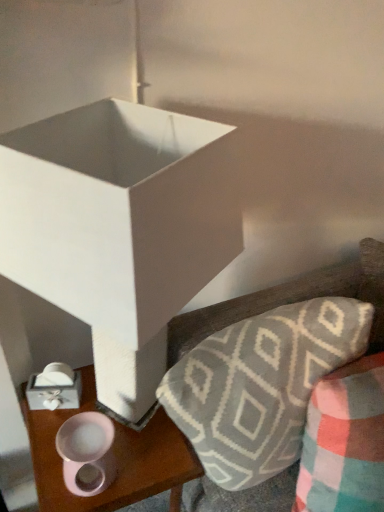
Identify the location of vacant area that lies to the right of pink matte candle holder at lower left. (146, 463).